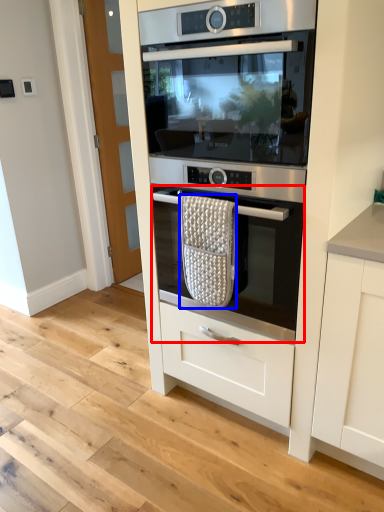
Question: Which point is further to the camera, oven (highlighted by a red box) or material (highlighted by a blue box)?

Choices:
 (A) oven
 (B) material

Answer: (B)